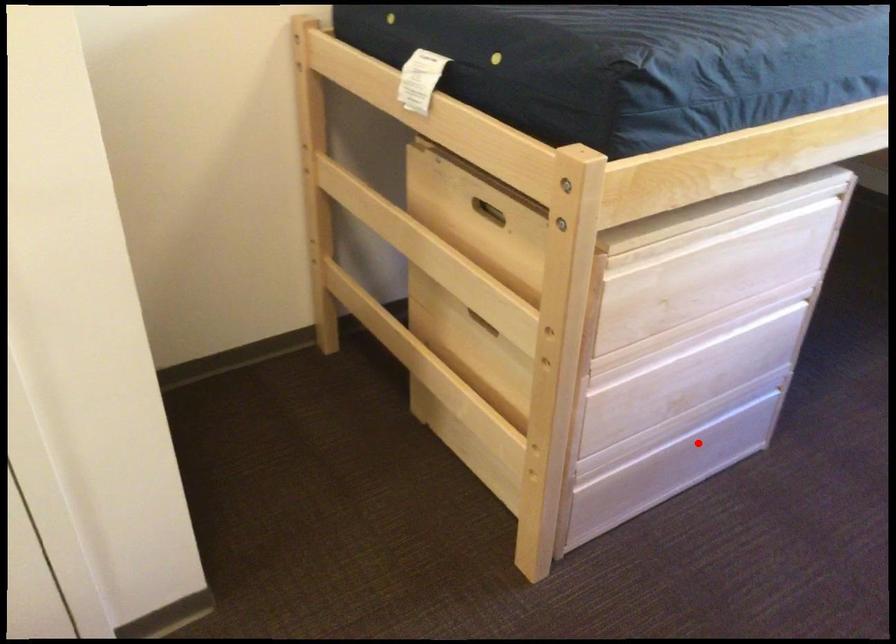
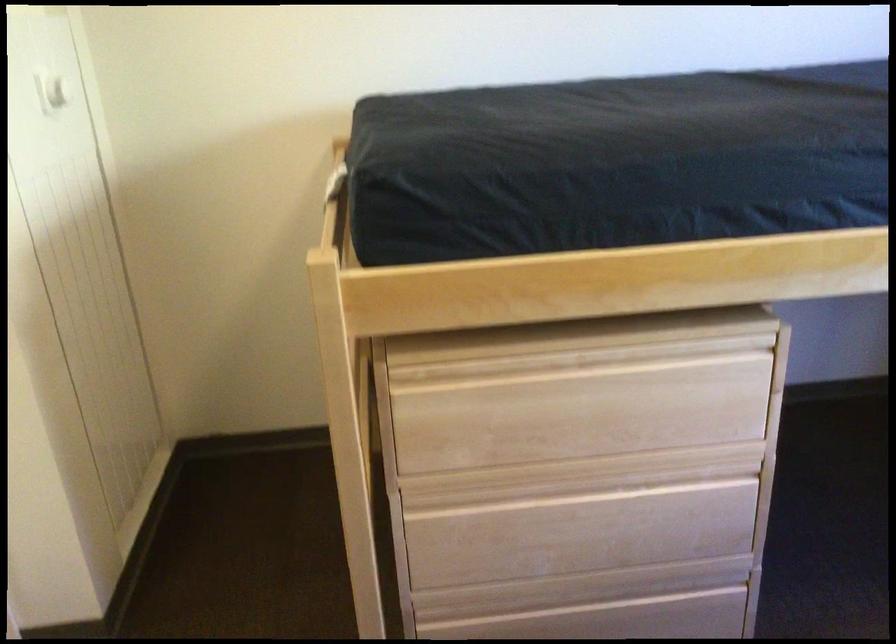
Question: I am providing you with two images of the same scene from different viewpoints. Given a red point in image1, look at the same physical point in image2. Is it:

Choices:
 (A) Closer to the viewpoint
 (B) Farther from the viewpoint

Answer: (A)